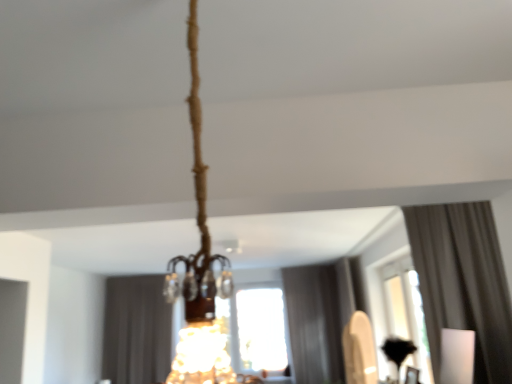
Question: Can you confirm if transparent glass window at center is wider than gray fabric curtain at center, acting as the second curtain starting from the back?

Choices:
 (A) no
 (B) yes

Answer: (A)

Question: From a real-world perspective, is transparent glass window at center located beneath gray fabric curtain at center, which is counted as the second curtain, starting from the left?

Choices:
 (A) yes
 (B) no

Answer: (B)

Question: Would you say transparent glass window at center is outside gray fabric curtain at center, acting as the 2th curtain starting from the right?

Choices:
 (A) yes
 (B) no

Answer: (A)

Question: Can you confirm if transparent glass window at center is smaller than gray fabric curtain at center, acting as the second curtain starting from the back?

Choices:
 (A) no
 (B) yes

Answer: (B)

Question: From a real-world perspective, is transparent glass window at center physically above gray fabric curtain at center, acting as the 2th curtain starting from the right?

Choices:
 (A) no
 (B) yes

Answer: (B)

Question: Is transparent glass window at center at the left side of gray fabric curtain at center, which is counted as the second curtain, starting from the left?

Choices:
 (A) no
 (B) yes

Answer: (A)

Question: From a real-world perspective, is white fabric curtain at upper right, the 1th curtain in the front-to-back sequence, below dark gray fabric curtain at center, which ranks as the 1th curtain in back-to-front order?

Choices:
 (A) yes
 (B) no

Answer: (B)

Question: Is dark gray fabric curtain at center, arranged as the 3th curtain when viewed from the front, at the back of white fabric curtain at upper right, the 1th curtain in the front-to-back sequence?

Choices:
 (A) yes
 (B) no

Answer: (B)

Question: Considering the relative positions of white fabric curtain at upper right, the first curtain from the right, and dark gray fabric curtain at center, arranged as the 3th curtain when viewed from the front, in the image provided, is white fabric curtain at upper right, the first curtain from the right, in front of dark gray fabric curtain at center, arranged as the 3th curtain when viewed from the front,?

Choices:
 (A) yes
 (B) no

Answer: (A)

Question: Does white fabric curtain at upper right, which is counted as the third curtain, starting from the left, have a lesser width compared to dark gray fabric curtain at center, which ranks as the 1th curtain in back-to-front order?

Choices:
 (A) yes
 (B) no

Answer: (A)

Question: Would you say white fabric curtain at upper right, which is counted as the third curtain, starting from the left, is outside dark gray fabric curtain at center, arranged as the 3th curtain when viewed from the front?

Choices:
 (A) no
 (B) yes

Answer: (B)

Question: From the image's perspective, is white fabric curtain at upper right, which is the third curtain from back to front, below dark gray fabric curtain at center, arranged as the 3th curtain when viewed from the front?

Choices:
 (A) yes
 (B) no

Answer: (B)

Question: Is transparent glass window at center oriented away from white fabric curtain at upper right, which is the third curtain from back to front?

Choices:
 (A) no
 (B) yes

Answer: (A)